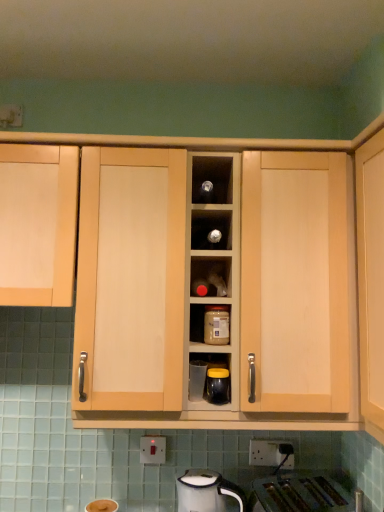
This screenshot has height=512, width=384. What do you see at coordinates (195, 140) in the screenshot?
I see `light wood cabinet at center, positioned as the second cabinetry in left-to-right order` at bounding box center [195, 140].

The width and height of the screenshot is (384, 512). What are the coordinates of `light wood cabinet at center, positioned as the second cabinetry in left-to-right order` in the screenshot? It's located at (195, 140).

The image size is (384, 512). I want to click on matte plastic jar at center, so [x=216, y=325].

What is the approximate height of matte black jar at center, the first appliance when ordered from front to back?

matte black jar at center, the first appliance when ordered from front to back, is 3.60 inches in height.

This screenshot has width=384, height=512. What are the coordinates of `matte black jar at center, marked as the second appliance in a left-to-right arrangement` in the screenshot? It's located at (218, 385).

Describe the element at coordinates (207, 492) in the screenshot. I see `white glossy electric kettle at lower center` at that location.

Image resolution: width=384 pixels, height=512 pixels. In order to click on clear glass jar at center, the 2th appliance from the front in this screenshot , I will do `click(197, 380)`.

From the image's perspective, is light wood cabinet at left, which is counted as the first cabinetry, starting from the left, above white glossy electric kettle at lower center?

Correct, light wood cabinet at left, which is counted as the first cabinetry, starting from the left, appears higher than white glossy electric kettle at lower center in the image.

Based on their sizes in the image, would you say light wood cabinet at left, which is counted as the first cabinetry, starting from the left, is bigger or smaller than white glossy electric kettle at lower center?

light wood cabinet at left, which is counted as the first cabinetry, starting from the left, is bigger than white glossy electric kettle at lower center.

Considering the positions of objects light wood cabinet at left, which ranks as the second cabinetry in right-to-left order, and white glossy electric kettle at lower center in the image provided, who is more to the right, light wood cabinet at left, which ranks as the second cabinetry in right-to-left order, or white glossy electric kettle at lower center?

From the viewer's perspective, white glossy electric kettle at lower center appears more on the right side.

From the image's perspective, which cabinetry is the 2nd one above the white glossy electric kettle at lower center? Please provide its 2D coordinates.

[(38, 224)]

From a real-world perspective, is white glossy electric kettle at lower center positioned under matte black jar at center, marked as the second appliance in a left-to-right arrangement, based on gravity?

Yes.

Considering the positions of objects white glossy electric kettle at lower center and matte black jar at center, marked as the second appliance in a left-to-right arrangement, in the image provided, who is more to the right, white glossy electric kettle at lower center or matte black jar at center, marked as the second appliance in a left-to-right arrangement,?

matte black jar at center, marked as the second appliance in a left-to-right arrangement, is more to the right.

Is white glossy electric kettle at lower center outside of matte black jar at center, the first appliance when ordered from front to back?

Yes.

Does white glossy electric kettle at lower center turn towards matte black jar at center, marked as the second appliance in a left-to-right arrangement?

No, white glossy electric kettle at lower center is not turned towards matte black jar at center, marked as the second appliance in a left-to-right arrangement.

Find the location of a particular element. The width and height of the screenshot is (384, 512). electric outlet above the white glossy electric kettle at lower center (from a real-world perspective) is located at coordinates (271, 453).

Relative to white plastic electric outlet at lower center, is white glossy electric kettle at lower center in front or behind?

white glossy electric kettle at lower center is in front of white plastic electric outlet at lower center.

Is white glossy electric kettle at lower center aimed at white plastic electric outlet at lower center?

No, white glossy electric kettle at lower center does not turn towards white plastic electric outlet at lower center.

Considering the sizes of objects light wood cabinet at left, which ranks as the second cabinetry in right-to-left order, and light wood cabinet at center, which is the first cabinetry in right-to-left order, in the image provided, who is bigger, light wood cabinet at left, which ranks as the second cabinetry in right-to-left order, or light wood cabinet at center, which is the first cabinetry in right-to-left order,?

With larger size is light wood cabinet at center, which is the first cabinetry in right-to-left order.

Considering the positions of objects light wood cabinet at left, which ranks as the second cabinetry in right-to-left order, and light wood cabinet at center, which is the first cabinetry in right-to-left order, in the image provided, who is more to the left, light wood cabinet at left, which ranks as the second cabinetry in right-to-left order, or light wood cabinet at center, which is the first cabinetry in right-to-left order,?

Positioned to the left is light wood cabinet at left, which ranks as the second cabinetry in right-to-left order.

In the scene shown: Is light wood cabinet at left, which ranks as the second cabinetry in right-to-left order, oriented towards light wood cabinet at center, which is the first cabinetry in right-to-left order?

No, light wood cabinet at left, which ranks as the second cabinetry in right-to-left order, is not turned towards light wood cabinet at center, which is the first cabinetry in right-to-left order.

Considering the relative sizes of light wood cabinet at left, which ranks as the second cabinetry in right-to-left order, and light wood cabinet at center, positioned as the second cabinetry in left-to-right order, in the image provided, is light wood cabinet at left, which ranks as the second cabinetry in right-to-left order, wider than light wood cabinet at center, positioned as the second cabinetry in left-to-right order,?

Incorrect, the width of light wood cabinet at left, which ranks as the second cabinetry in right-to-left order, does not surpass that of light wood cabinet at center, positioned as the second cabinetry in left-to-right order.

How far apart are white plastic electric outlet at lower center and light wood cabinet at center, positioned as the second cabinetry in left-to-right order?

white plastic electric outlet at lower center is 24.64 inches from light wood cabinet at center, positioned as the second cabinetry in left-to-right order.

Which of these two, white plastic electric outlet at lower center or light wood cabinet at center, which is the first cabinetry in right-to-left order, is smaller?

white plastic electric outlet at lower center.

Considering the relative positions of white plastic electric outlet at lower center and light wood cabinet at center, positioned as the second cabinetry in left-to-right order, in the image provided, is white plastic electric outlet at lower center to the left of light wood cabinet at center, positioned as the second cabinetry in left-to-right order, from the viewer's perspective?

No.

From a real-world perspective, is white plastic electric outlet at lower center physically above light wood cabinet at center, which is the first cabinetry in right-to-left order?

Incorrect, from a real-world perspective, white plastic electric outlet at lower center is lower than light wood cabinet at center, which is the first cabinetry in right-to-left order.

Does matte plastic jar at center touch light wood cabinet at center, which is the first cabinetry in right-to-left order?

No, matte plastic jar at center is not with light wood cabinet at center, which is the first cabinetry in right-to-left order.

From a real-world perspective, is matte plastic jar at center positioned over light wood cabinet at center, positioned as the second cabinetry in left-to-right order, based on gravity?

No, from a real-world perspective, matte plastic jar at center is not over light wood cabinet at center, positioned as the second cabinetry in left-to-right order

Between matte plastic jar at center and light wood cabinet at center, positioned as the second cabinetry in left-to-right order, which one has larger size?

light wood cabinet at center, positioned as the second cabinetry in left-to-right order, is bigger.

Find the location of a particular element. The height and width of the screenshot is (512, 384). cabinetry on the right of matte plastic jar at center is located at coordinates (195, 140).

Considering the points (226, 395) and (373, 424), which point is in front, point (226, 395) or point (373, 424)?

Point (373, 424)

In terms of size, does matte black jar at center, which ranks as the second appliance in back-to-front order, appear bigger or smaller than light wood cabinet at center, which is the first cabinetry in right-to-left order?

In the image, matte black jar at center, which ranks as the second appliance in back-to-front order, appears to be smaller than light wood cabinet at center, which is the first cabinetry in right-to-left order.

Is matte black jar at center, which ranks as the first appliance in right-to-left order, wider than light wood cabinet at center, which is the first cabinetry in right-to-left order?

In fact, matte black jar at center, which ranks as the first appliance in right-to-left order, might be narrower than light wood cabinet at center, which is the first cabinetry in right-to-left order.

There is a white glossy electric kettle at lower center. In order to click on the 2nd cabinetry above it (from the image's perspective) in this screenshot , I will do `click(38, 224)`.

You are a GUI agent. You are given a task and a screenshot of the screen. Output one action in this format:
    pyautogui.click(x=<x>, y=<y>)
    Task: Click on the home appliance below the matte black jar at center, the first appliance when ordered from front to back (from the image's perspective)
    Image resolution: width=384 pixels, height=512 pixels.
    Given the screenshot: What is the action you would take?
    pyautogui.click(x=207, y=492)

Considering their positions, is white plastic electric outlet at lower center positioned further to clear glass jar at center, which is the first appliance from back to front, than white glossy electric kettle at lower center?

white plastic electric outlet at lower center is further to clear glass jar at center, which is the first appliance from back to front.

Estimate the real-world distances between objects in this image. Which object is further from matte plastic jar at center, light wood cabinet at left, which is counted as the first cabinetry, starting from the left, or light wood cabinet at center, positioned as the second cabinetry in left-to-right order?

light wood cabinet at left, which is counted as the first cabinetry, starting from the left, is further to matte plastic jar at center.

Considering their positions, is light wood cabinet at center, which is the first cabinetry in right-to-left order, positioned further to matte black jar at center, which ranks as the first appliance in right-to-left order, than white glossy electric kettle at lower center?

The object further to matte black jar at center, which ranks as the first appliance in right-to-left order, is light wood cabinet at center, which is the first cabinetry in right-to-left order.

Based on their spatial positions, is clear glass jar at center, the 2th appliance from the front, or matte black jar at center, which ranks as the first appliance in right-to-left order, further from matte plastic jar at center?

clear glass jar at center, the 2th appliance from the front, is positioned further to the anchor matte plastic jar at center.

Looking at the image, which one is located further to matte black jar at center, the first appliance when ordered from front to back, white plastic electric outlet at lower center or light wood cabinet at left, which is counted as the first cabinetry, starting from the left?

light wood cabinet at left, which is counted as the first cabinetry, starting from the left, lies further to matte black jar at center, the first appliance when ordered from front to back, than the other object.

Which object lies nearer to the anchor point light wood cabinet at left, which is counted as the first cabinetry, starting from the left, white plastic electric outlet at lower center or light wood cabinet at center, which is the first cabinetry in right-to-left order?

light wood cabinet at center, which is the first cabinetry in right-to-left order, is positioned closer to the anchor light wood cabinet at left, which is counted as the first cabinetry, starting from the left.

From the image, which object appears to be nearer to clear glass jar at center, positioned as the first appliance in left-to-right order, matte black jar at center, which ranks as the first appliance in right-to-left order, or matte plastic jar at center?

Based on the image, matte black jar at center, which ranks as the first appliance in right-to-left order, appears to be nearer to clear glass jar at center, positioned as the first appliance in left-to-right order.

Estimate the real-world distances between objects in this image. Which object is closer to matte plastic jar at center, matte black jar at center, the first appliance when ordered from front to back, or white plastic electric outlet at lower center?

The object closer to matte plastic jar at center is matte black jar at center, the first appliance when ordered from front to back.

Locate an element on the screen. The width and height of the screenshot is (384, 512). appliance between matte plastic jar at center and matte black jar at center, which ranks as the first appliance in right-to-left order, in the vertical direction is located at coordinates 197,380.

Locate an element on the screen. The height and width of the screenshot is (512, 384). kitchen appliance between light wood cabinet at center, which is the first cabinetry in right-to-left order, and white plastic electric outlet at lower center in the up-down direction is located at coordinates (216, 325).

The width and height of the screenshot is (384, 512). I want to click on kitchen appliance located between light wood cabinet at left, which is counted as the first cabinetry, starting from the left, and white plastic electric outlet at lower center in the left-right direction, so click(216, 325).

Locate an element on the screen. The width and height of the screenshot is (384, 512). appliance between clear glass jar at center, positioned as the first appliance in left-to-right order, and white plastic electric outlet at lower center from top to bottom is located at coordinates (218, 385).